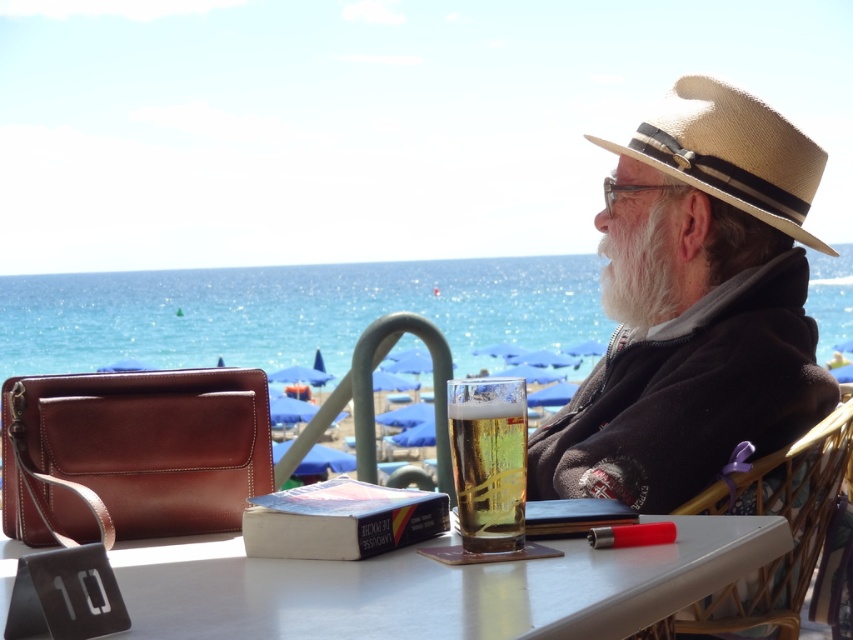
Does point (471, 396) lie in front of point (640, 285)?

Yes, it is.

Where is `translucent glass beer at center`? Image resolution: width=853 pixels, height=640 pixels. translucent glass beer at center is located at coordinates (488, 461).

Locate an element on the screen. The height and width of the screenshot is (640, 853). translucent glass beer at center is located at coordinates (488, 461).

Is metallic silver table at center bigger than white fluffy beard at center?

Yes.

Which is more to the right, metallic silver table at center or white fluffy beard at center?

white fluffy beard at center is more to the right.

Which is behind, point (122, 556) or point (606, 296)?

Point (606, 296)

This screenshot has width=853, height=640. What are the coordinates of `metallic silver table at center` in the screenshot? It's located at (434, 588).

Which is behind, point (741, 164) or point (479, 476)?

The point (741, 164) is more distant.

Which is more to the left, straw hat at center or translucent glass beer at center?

From the viewer's perspective, translucent glass beer at center appears more on the left side.

Is point (646, 157) farther from camera compared to point (514, 435)?

Yes.

At what (x,y) coordinates should I click in order to perform the action: click on straw hat at center. Please return your answer as a coordinate pair (x, y). Looking at the image, I should click on (730, 152).